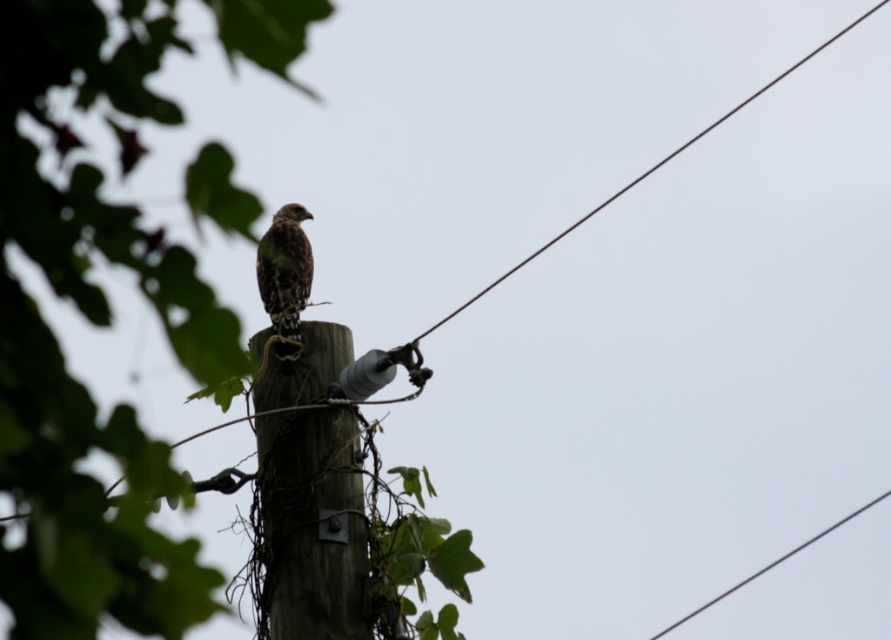
Can you confirm if brown wood post at center is thinner than brown speckled falcon at center?

Incorrect, brown wood post at center's width is not less than brown speckled falcon at center's.

Does point (289, 396) come behind point (301, 289)?

No, (289, 396) is in front of (301, 289).

Identify the location of brown wood post at center. Image resolution: width=891 pixels, height=640 pixels. (308, 492).

Does green leafy tree at center have a smaller size compared to brown speckled falcon at center?

No.

Between green leafy tree at center and brown speckled falcon at center, which one is positioned higher?

brown speckled falcon at center is higher up.

Who is more forward, (165, 580) or (263, 241)?

Point (165, 580) is more forward.

Find the location of `green leafy tree at center`. green leafy tree at center is located at coordinates (91, 323).

Is green leafy tree at center below brown wood post at center?

No, green leafy tree at center is not below brown wood post at center.

Can you confirm if green leafy tree at center is positioned to the right of brown wood post at center?

No, green leafy tree at center is not to the right of brown wood post at center.

Which is behind, point (82, 198) or point (285, 426)?

Positioned behind is point (285, 426).

In order to click on green leafy tree at center in this screenshot , I will do `click(91, 323)`.